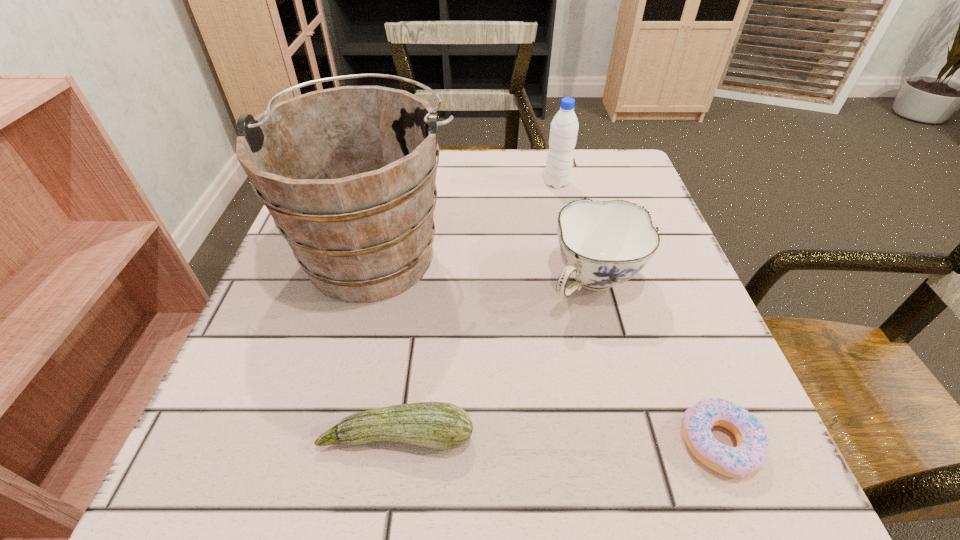
At what (x,y) coordinates should I click in order to perform the action: click on the tallest object. Please return your answer as a coordinate pair (x, y). Looking at the image, I should click on (348, 174).

The image size is (960, 540). Identify the location of the second tallest object. (564, 127).

Locate an element on the screen. The width and height of the screenshot is (960, 540). water bottle is located at coordinates (564, 127).

Identify the location of chinaware. (603, 243).

Identify the location of the second shortest object. The width and height of the screenshot is (960, 540). (439, 425).

Locate an element on the screen. doughnut is located at coordinates pos(752,450).

Locate an element on the screen. The width and height of the screenshot is (960, 540). vacant region located on the handle side of the bucket is located at coordinates (397, 164).

Locate an element on the screen. This screenshot has width=960, height=540. free space located 0.090m on the handle side of the bucket is located at coordinates pos(394,177).

Find the location of a particular element. vacant space located 0.100m on the handle side of the bucket is located at coordinates (395, 175).

What are the coordinates of `vacant space located on the left of the farthest object` in the screenshot? It's located at (442, 183).